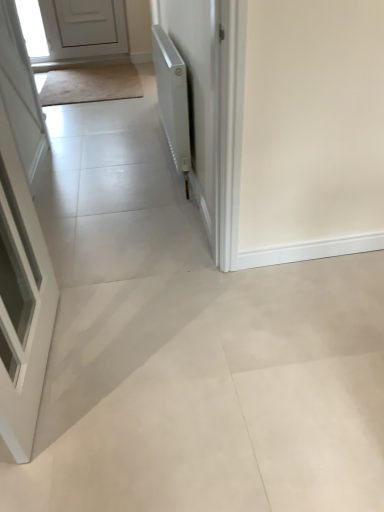
In order to click on vacant area located to the right-hand side of white glossy door at left, the first door positioned from the right in this screenshot , I will do [161, 361].